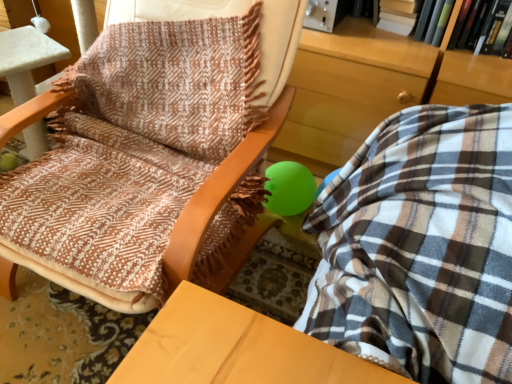
Question: Could you tell me if green matte book at upper right, acting as the 2th book starting from the left, is facing brown woven fabric at center?

Choices:
 (A) no
 (B) yes

Answer: (A)

Question: Is green matte book at upper right, acting as the 2th book starting from the left, directly adjacent to brown woven fabric at center?

Choices:
 (A) yes
 (B) no

Answer: (B)

Question: Is green matte book at upper right, the 2th book from the right, turned away from brown woven fabric at center?

Choices:
 (A) yes
 (B) no

Answer: (B)

Question: Considering the relative positions of green matte book at upper right, the 2th book from the right, and brown woven fabric at center in the image provided, is green matte book at upper right, the 2th book from the right, in front of brown woven fabric at center?

Choices:
 (A) no
 (B) yes

Answer: (A)

Question: From a real-world perspective, is green matte book at upper right, acting as the 2th book starting from the left, located beneath brown woven fabric at center?

Choices:
 (A) no
 (B) yes

Answer: (A)

Question: Is green matte book at upper right, the 2th book from the right, wider or thinner than hardcover book at upper right, which appears as the third book when viewed from the left?

Choices:
 (A) thin
 (B) wide

Answer: (B)

Question: Do you think green matte book at upper right, the 2th book from the right, is within hardcover book at upper right, which appears as the third book when viewed from the left, or outside of it?

Choices:
 (A) outside
 (B) inside

Answer: (A)

Question: From a real-world perspective, is green matte book at upper right, the 2th book from the right, above or below hardcover book at upper right, which ranks as the first book in right-to-left order?

Choices:
 (A) above
 (B) below

Answer: (A)

Question: Considering the positions of green matte book at upper right, the 2th book from the right, and hardcover book at upper right, which appears as the third book when viewed from the left, in the image, is green matte book at upper right, the 2th book from the right, taller or shorter than hardcover book at upper right, which appears as the third book when viewed from the left,?

Choices:
 (A) short
 (B) tall

Answer: (B)

Question: From a real-world perspective, is hardcover book at upper right, which appears as the third book when viewed from the left, above or below green matte book at upper right, the 2th book from the right?

Choices:
 (A) above
 (B) below

Answer: (B)

Question: From the image's perspective, is hardcover book at upper right, which appears as the third book when viewed from the left, located above or below green matte book at upper right, the 2th book from the right?

Choices:
 (A) below
 (B) above

Answer: (A)

Question: In terms of width, does hardcover book at upper right, which ranks as the first book in right-to-left order, look wider or thinner when compared to green matte book at upper right, the 2th book from the right?

Choices:
 (A) thin
 (B) wide

Answer: (A)

Question: Is hardcover book at upper right, which ranks as the first book in right-to-left order, inside or outside of green matte book at upper right, the 2th book from the right?

Choices:
 (A) outside
 (B) inside

Answer: (A)

Question: Considering the positions of point (440, 13) and point (71, 132), is point (440, 13) closer or farther from the camera than point (71, 132)?

Choices:
 (A) farther
 (B) closer

Answer: (A)

Question: Looking at the image, does green matte book at upper right, the 2th book from the right, seem bigger or smaller compared to brown woven fabric at center?

Choices:
 (A) big
 (B) small

Answer: (B)